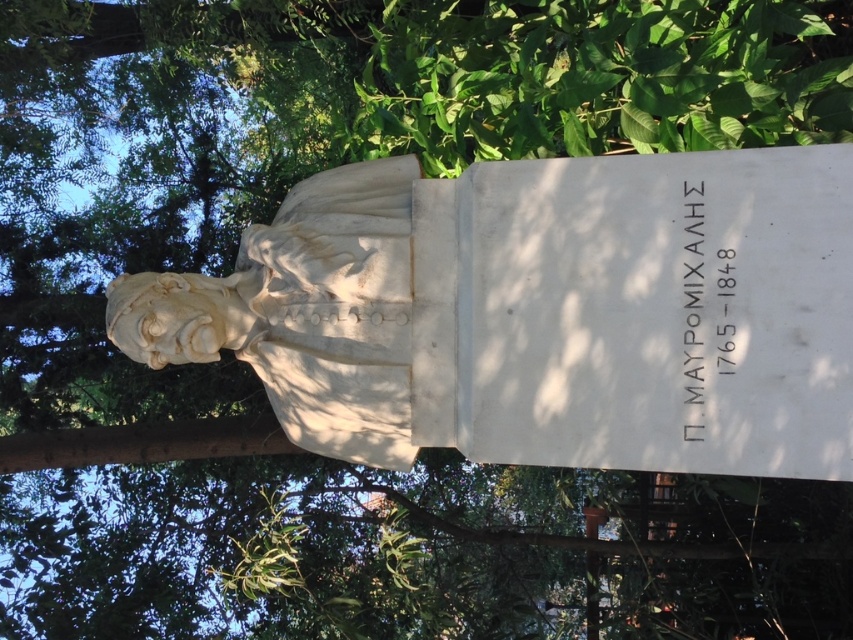
Question: Does white marble bust at left appear over white stone inscription at center?

Choices:
 (A) yes
 (B) no

Answer: (A)

Question: Is white marble bust at left positioned before white stone inscription at center?

Choices:
 (A) yes
 (B) no

Answer: (A)

Question: Considering the relative positions of white marble bust at left and white stone inscription at center in the image provided, where is white marble bust at left located with respect to white stone inscription at center?

Choices:
 (A) below
 (B) above

Answer: (B)

Question: Among these objects, which one is nearest to the camera?

Choices:
 (A) white marble bust at left
 (B) white stone inscription at center

Answer: (A)